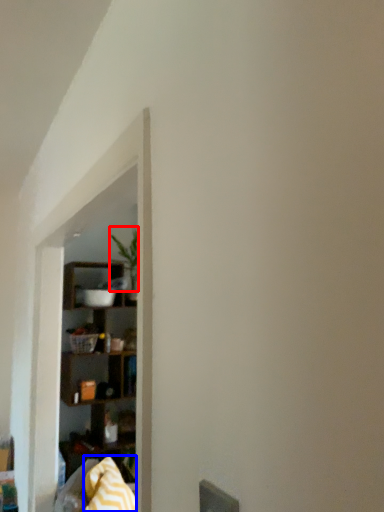
Question: Which object appears farthest to the camera in this image, plant (highlighted by a red box) or blanket (highlighted by a blue box)?

Choices:
 (A) plant
 (B) blanket

Answer: (A)